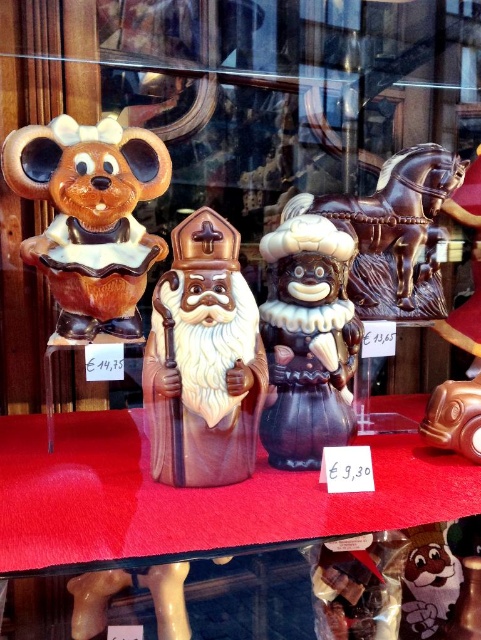
Looking at this image, you are a customer standing outside the shop window. You see the shiny chocolate figurine at center displayed inside the window. Can you reach it with your hand if you press against the glass?

The shiny chocolate figurine at center is 34.24 inches from the camera, which is farther than the typical human arm length when pressing against the glass. Therefore, you cannot reach it with your hand.

You are a delivery person who needs to place a new chocolate figurine that is 10 inches wide into the shop window display. The current display has a shiny chocolate figurine at center and a shiny chocolate horse at center. Can the new figurine fit between them without overlapping?

The distance between the shiny chocolate figurine at center and the shiny chocolate horse at center is 8.88 inches. Since the new figurine is 10 inches wide, it cannot fit between them without overlapping as the space is smaller than the figurine.

You are a customer looking at the shop window display. You see the shiny chocolate figurine at center and the shiny chocolate horse at center. Which one appears taller?

The shiny chocolate figurine at center is much taller than the shiny chocolate horse at center according to the description.